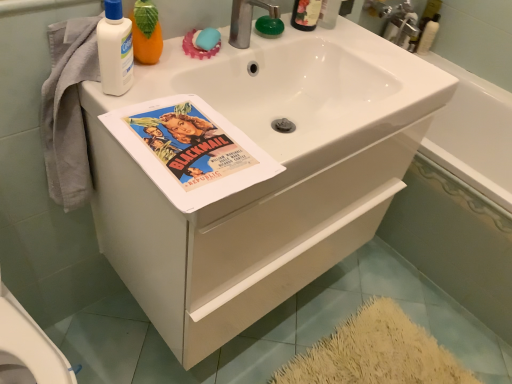
What do you see at coordinates (471, 115) in the screenshot?
I see `white glossy bathtub at upper right, the second bath viewed from the right` at bounding box center [471, 115].

Measure the distance between point [422,52] and camera.

Point [422,52] is 1.96 meters from camera.

Describe the element at coordinates (115, 49) in the screenshot. This screenshot has height=384, width=512. I see `white matte lotion at upper left, positioned as the 2th cleaning product in right-to-left order` at that location.

Image resolution: width=512 pixels, height=384 pixels. What do you see at coordinates (306, 14) in the screenshot?
I see `translucent plastic mouthwash at upper right` at bounding box center [306, 14].

Locate an element on the screen. The height and width of the screenshot is (384, 512). white matte cabinet at center is located at coordinates (264, 181).

You are a GUI agent. You are given a task and a screenshot of the screen. Output one action in this format:
    pyautogui.click(x=<x>, y=<y>)
    Task: Click on the white glossy bathtub at center, the 2th bath viewed from the left
    
    Given the screenshot: What is the action you would take?
    pyautogui.click(x=462, y=201)

Between white glossy bathtub at center, the 1th bath in the right-to-left sequence, and translucent plastic bottle at upper right, the 1th cleaning product positioned from the right, which one has larger size?

Bigger between the two is white glossy bathtub at center, the 1th bath in the right-to-left sequence.

Which object is further away from the camera, white glossy bathtub at center, the 1th bath in the right-to-left sequence, or translucent plastic bottle at upper right, the 1th cleaning product positioned from the right?

translucent plastic bottle at upper right, the 1th cleaning product positioned from the right, is further from the camera.

In the scene shown: Is white glossy bathtub at center, the 1th bath in the right-to-left sequence, taller than translucent plastic bottle at upper right, which ranks as the second cleaning product in left-to-right order?

Indeed, white glossy bathtub at center, the 1th bath in the right-to-left sequence, has a greater height compared to translucent plastic bottle at upper right, which ranks as the second cleaning product in left-to-right order.

Can you confirm if white glossy bathtub at center, the 1th bath in the right-to-left sequence, is positioned to the left of translucent plastic bottle at upper right, the 1th cleaning product viewed from the back?

No.

Identify the location of tap that appears on the left of translucent plastic bottle at upper right, the 1th cleaning product positioned from the right. (250, 22).

Would you say translucent plastic bottle at upper right, acting as the 2th cleaning product starting from the bottom, is to the left or to the right of silver metallic faucet at upper center in the picture?

In the image, translucent plastic bottle at upper right, acting as the 2th cleaning product starting from the bottom, appears on the right side of silver metallic faucet at upper center.

From the image's perspective, who appears lower, translucent plastic bottle at upper right, acting as the 2th cleaning product starting from the bottom, or silver metallic faucet at upper center?

silver metallic faucet at upper center, from the image's perspective.

Is point (428, 21) closer to camera compared to point (251, 1)?

That is False.

From a real-world perspective, which object rests below the other?

From a 3D spatial view, white glossy bathtub at center, the 1th bath in the right-to-left sequence, is below.

Between white matte cabinet at center and white glossy bathtub at center, the 1th bath in the right-to-left sequence, which one has less height?

white glossy bathtub at center, the 1th bath in the right-to-left sequence.

Could you tell me if white matte cabinet at center is turned towards white glossy bathtub at center, the 2th bath viewed from the left?

No, white matte cabinet at center is not facing towards white glossy bathtub at center, the 2th bath viewed from the left.

Considering the positions of objects white matte cabinet at center and white glossy bathtub at center, the 2th bath viewed from the left, in the image provided, who is more to the right, white matte cabinet at center or white glossy bathtub at center, the 2th bath viewed from the left,?

white glossy bathtub at center, the 2th bath viewed from the left.

Is silver metallic faucet at upper center surrounded by matte paper poster at center?

Actually, silver metallic faucet at upper center is outside matte paper poster at center.

Does matte paper poster at center have a lesser width compared to silver metallic faucet at upper center?

Incorrect, the width of matte paper poster at center is not less than that of silver metallic faucet at upper center.

From the image's perspective, is matte paper poster at center over silver metallic faucet at upper center?

No, from the image's perspective, matte paper poster at center is not on top of silver metallic faucet at upper center.

Is matte paper poster at center next to silver metallic faucet at upper center and touching it?

matte paper poster at center and silver metallic faucet at upper center are not in contact.

Is blue rubber soap at upper center beside white matte cabinet at center?

blue rubber soap at upper center is not next to white matte cabinet at center, and they're not touching.

How far apart are blue rubber soap at upper center and white matte cabinet at center?

blue rubber soap at upper center is 45.47 centimeters from white matte cabinet at center.

Could white matte cabinet at center be considered to be inside blue rubber soap at upper center?

That's incorrect, white matte cabinet at center is not inside blue rubber soap at upper center.

Where is `bathroom cabinet on the right of blue rubber soap at upper center`? Image resolution: width=512 pixels, height=384 pixels. bathroom cabinet on the right of blue rubber soap at upper center is located at coordinates (264, 181).

Is silver metallic faucet at upper center with white matte cabinet at center?

They are not placed beside each other.

Looking at the image, does silver metallic faucet at upper center seem bigger or smaller compared to white matte cabinet at center?

silver metallic faucet at upper center is smaller than white matte cabinet at center.

In terms of height, does silver metallic faucet at upper center look taller or shorter compared to white matte cabinet at center?

In the image, silver metallic faucet at upper center appears to be shorter than white matte cabinet at center.

Considering the positions of objects silver metallic faucet at upper center and white matte cabinet at center in the image provided, who is more to the right, silver metallic faucet at upper center or white matte cabinet at center?

white matte cabinet at center.

From a real-world perspective, does translucent plastic bottle at upper right, the 2th cleaning product in the front-to-back sequence, stand above blue rubber soap at upper center?

Actually, translucent plastic bottle at upper right, the 2th cleaning product in the front-to-back sequence, is physically below blue rubber soap at upper center in the real world.

Is translucent plastic bottle at upper right, acting as the 2th cleaning product starting from the bottom, behind blue rubber soap at upper center?

Yes, translucent plastic bottle at upper right, acting as the 2th cleaning product starting from the bottom, is behind blue rubber soap at upper center.

Identify the location of soap below the translucent plastic bottle at upper right, the 1th cleaning product viewed from the back (from the image's perspective). (206, 39).

Where is `the 2nd cleaning product above the white glossy bathtub at center, the 1th bath in the right-to-left sequence (from the image's perspective)`? the 2nd cleaning product above the white glossy bathtub at center, the 1th bath in the right-to-left sequence (from the image's perspective) is located at coordinates (428, 34).

Identify the location of tap that is on the left side of translucent plastic bottle at upper right, the 2th cleaning product in the front-to-back sequence. (250, 22).

When comparing their distances from white glossy bathtub at center, the 2th bath viewed from the left, does translucent plastic mouthwash at upper right or white matte cabinet at center seem further?

The object further to white glossy bathtub at center, the 2th bath viewed from the left, is translucent plastic mouthwash at upper right.

Looking at the image, which one is located further to matte paper poster at center, silver metallic faucet at upper center or translucent plastic mouthwash at upper right?

The object further to matte paper poster at center is translucent plastic mouthwash at upper right.

Looking at the image, which one is located further to silver metallic faucet at upper center, translucent plastic bottle at upper right, the first cleaning product viewed from the top, or white glossy bathtub at upper right, which is the first bath from left to right?

translucent plastic bottle at upper right, the first cleaning product viewed from the top, is further to silver metallic faucet at upper center.

Based on their spatial positions, is silver metallic faucet at upper center or translucent plastic bottle at upper right, the first cleaning product viewed from the top, further from matte paper poster at center?

translucent plastic bottle at upper right, the first cleaning product viewed from the top, is positioned further to the anchor matte paper poster at center.

Based on their spatial positions, is white glossy bathtub at upper right, which is the first bath from left to right, or matte paper poster at center closer to white matte cabinet at center?

matte paper poster at center is closer to white matte cabinet at center.

Which object lies nearer to the anchor point white glossy bathtub at upper right, the second bath viewed from the right, white matte cabinet at center or silver metallic faucet at upper center?

Among the two, white matte cabinet at center is located nearer to white glossy bathtub at upper right, the second bath viewed from the right.

In the scene shown: Estimate the real-world distances between objects in this image. Which object is further from matte paper poster at center, translucent plastic bottle at upper right, the 1th cleaning product viewed from the back, or white glossy bathtub at center, the 2th bath viewed from the left?

translucent plastic bottle at upper right, the 1th cleaning product viewed from the back, is positioned further to the anchor matte paper poster at center.

Looking at the image, which one is located further to blue rubber soap at upper center, translucent plastic mouthwash at upper right or matte paper poster at center?

The object further to blue rubber soap at upper center is matte paper poster at center.

Image resolution: width=512 pixels, height=384 pixels. In order to click on bath between translucent plastic mouthwash at upper right and white glossy bathtub at center, the 2th bath viewed from the left, in the horizontal direction in this screenshot , I will do `click(471, 115)`.

This screenshot has height=384, width=512. I want to click on tap between white matte lotion at upper left, positioned as the 1th cleaning product in left-to-right order, and white glossy bathtub at center, the 1th bath in the right-to-left sequence, from left to right, so click(x=250, y=22).

Identify the location of bathroom cabinet between white matte lotion at upper left, which ranks as the 1th cleaning product in front-to-back order, and white glossy bathtub at center, the 2th bath viewed from the left, in the horizontal direction. Image resolution: width=512 pixels, height=384 pixels. (264, 181).

Identify the location of tap located between white matte lotion at upper left, the second cleaning product from the back, and white glossy bathtub at upper right, the second bath viewed from the right, in the left-right direction. This screenshot has width=512, height=384. (250, 22).